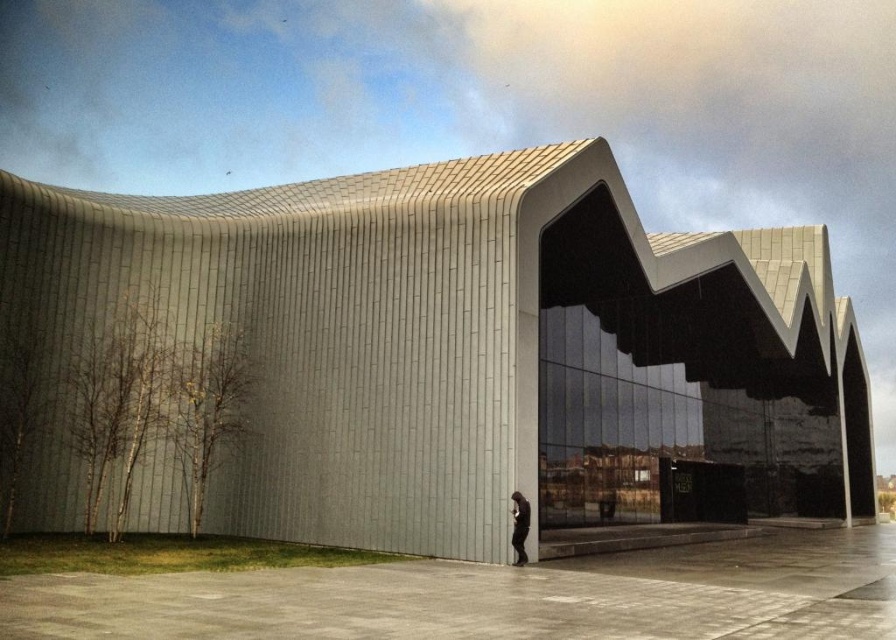
Question: Does sleek concrete building at center have a smaller size compared to dark gray fabric person at lower center?

Choices:
 (A) yes
 (B) no

Answer: (B)

Question: In this image, where is sleek concrete building at center located relative to dark gray fabric person at lower center?

Choices:
 (A) left
 (B) right

Answer: (B)

Question: Can you confirm if sleek concrete building at center is positioned above dark gray fabric person at lower center?

Choices:
 (A) no
 (B) yes

Answer: (B)